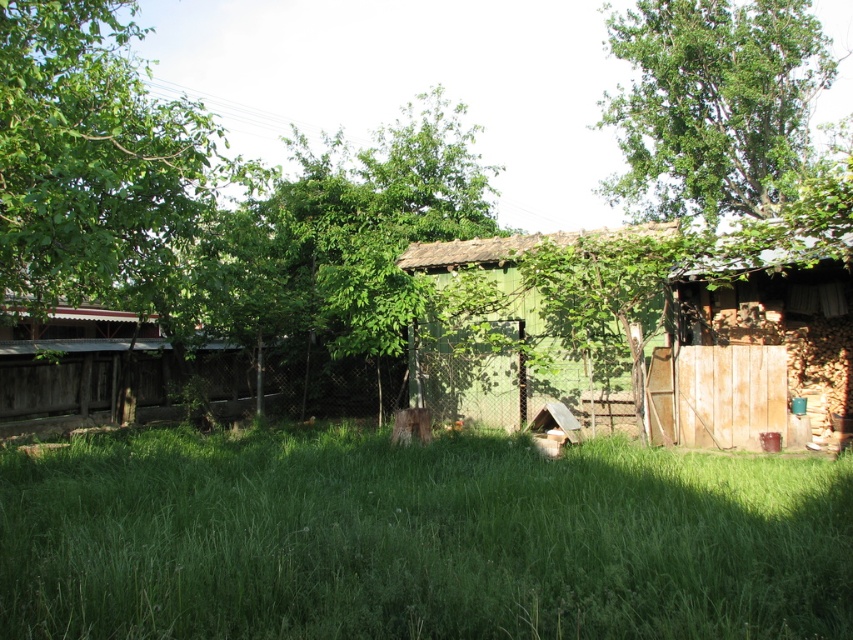
Question: Can you confirm if green leafy tree at upper right is positioned to the right of wooden shed at right?

Choices:
 (A) no
 (B) yes

Answer: (B)

Question: Is the position of green leafy tree at center less distant than that of green wooden hut at center?

Choices:
 (A) no
 (B) yes

Answer: (B)

Question: Which point is farther to the camera?

Choices:
 (A) green wooden hut at center
 (B) wooden shed at right
 (C) green leafy tree at upper right

Answer: (C)

Question: Is the position of green wooden hut at center more distant than that of wooden shed at right?

Choices:
 (A) no
 (B) yes

Answer: (A)

Question: Which point appears closest to the camera in this image?

Choices:
 (A) (701, 180)
 (B) (474, 272)
 (C) (827, 317)
 (D) (372, 353)

Answer: (D)

Question: Among these objects, which one is farthest from the camera?

Choices:
 (A) green wooden hut at center
 (B) green leafy tree at upper right
 (C) green leafy tree at center
 (D) wooden shed at right

Answer: (B)